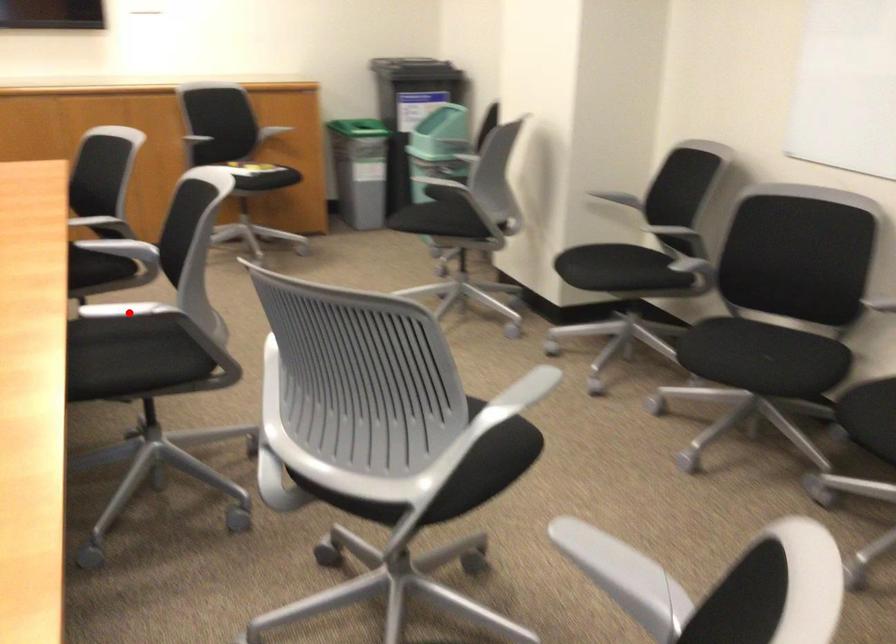
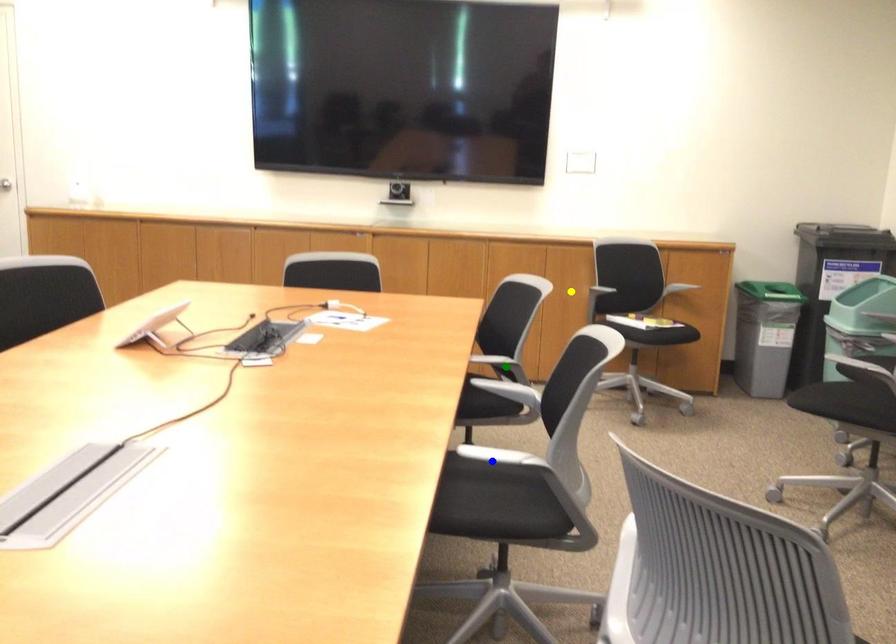
Question: I am providing you with two images of the same scene from different viewpoints. A red point is marked on the first image. You are given multiple points on the second image. Can you choose the point in image 2 that corresponds to the point in image 1?

Choices:
 (A) blue point
 (B) green point
 (C) yellow point

Answer: (A)